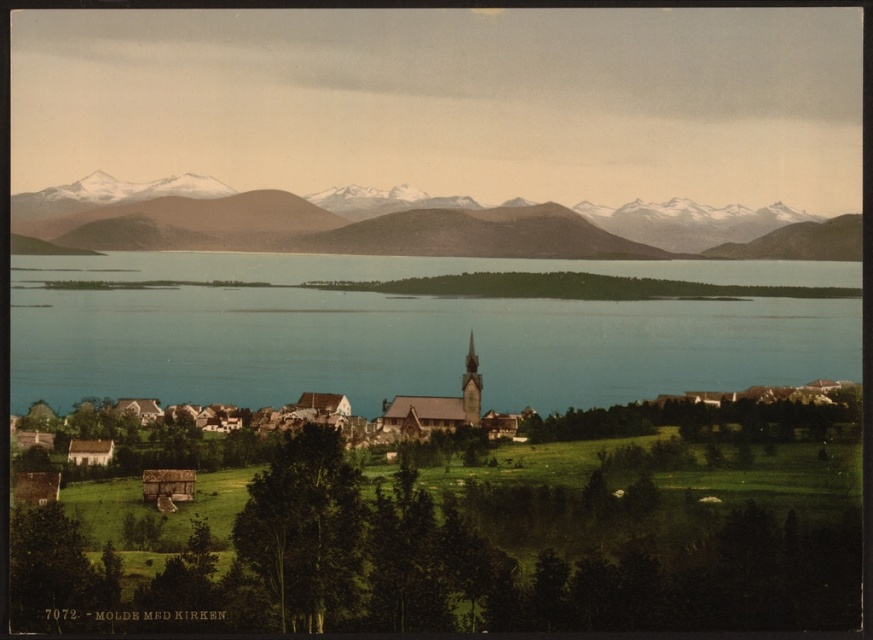
Is blue water at center to the left of brown textured mountains at upper center from the viewer's perspective?

In fact, blue water at center is to the right of brown textured mountains at upper center.

Locate an element on the screen. The width and height of the screenshot is (873, 640). blue water at center is located at coordinates (410, 332).

Is point (782, 301) closer to camera compared to point (400, 246)?

That is False.

Identify the location of blue water at center. The image size is (873, 640). (410, 332).

Can you confirm if blue water at center is positioned above brown wooden spire at center?

Indeed, blue water at center is positioned over brown wooden spire at center.

Can you confirm if blue water at center is positioned to the left of brown wooden spire at center?

Indeed, blue water at center is positioned on the left side of brown wooden spire at center.

In the scene shown: Who is more distant from viewer, (420,330) or (464,380)?

The point (420,330) is behind.

Find the location of a particular element. Image resolution: width=873 pixels, height=640 pixels. blue water at center is located at coordinates (410, 332).

Can you confirm if brown textured mountains at upper center is bigger than brown wooden spire at center?

Correct, brown textured mountains at upper center is larger in size than brown wooden spire at center.

Does brown textured mountains at upper center come behind brown wooden spire at center?

That is True.

Where is `brown textured mountains at upper center`? The height and width of the screenshot is (640, 873). brown textured mountains at upper center is located at coordinates (413, 224).